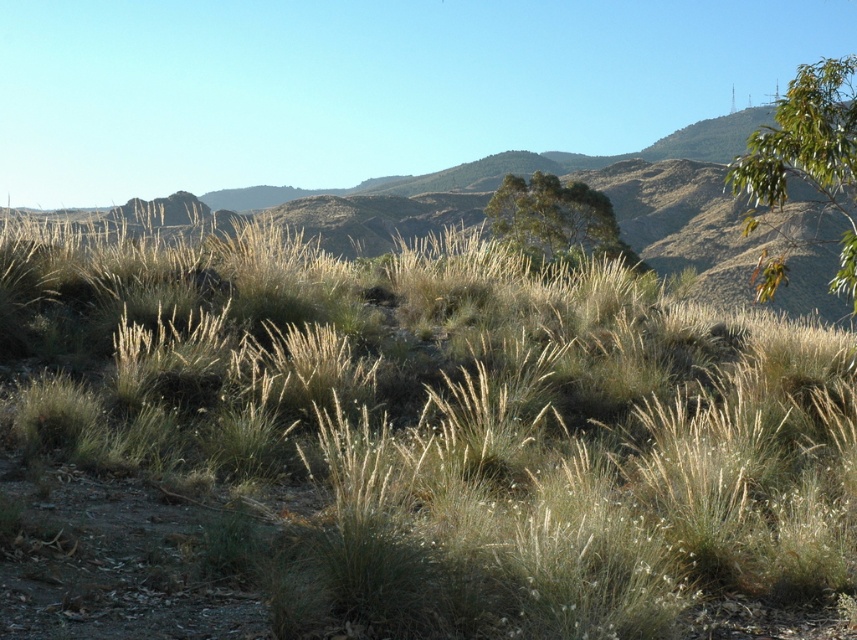
You are standing in the middle of the dry grass at center and want to walk towards the green leafy tree at upper right. Which direction should you move to reach it?

You should move to the right because the green leafy tree at upper right is to the right of the dry grass at center.

You are a hiker trying to find shade in the dry grass at center. The green leafy tree at upper right is nearby. Which direction should you walk to reach the shade provided by the tree?

The dry grass at center is positioned under the green leafy tree at upper right, so walking towards the upper right direction will lead you to the shade provided by the tree.